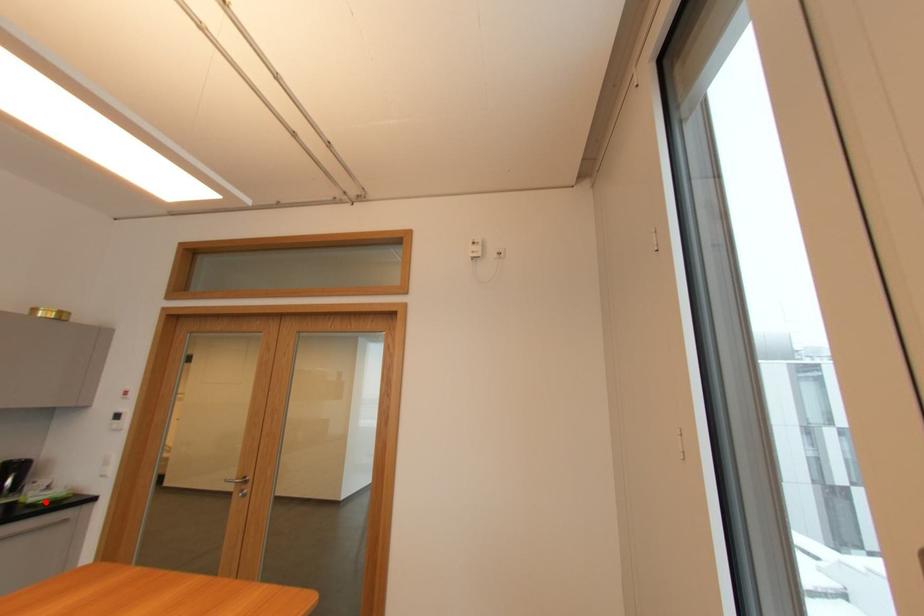
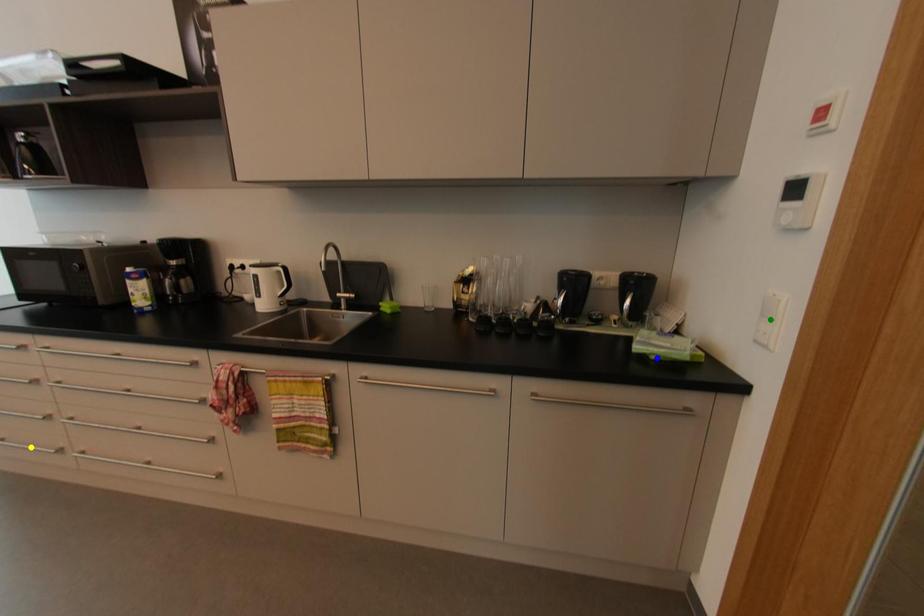
Question: I am providing you with two images of the same scene from different viewpoints. A red point is marked on the first image. You are given multiple points on the second image. Which point in image 2 is actually the same real-world point as the red point in image 1?

Choices:
 (A) green point
 (B) yellow point
 (C) blue point

Answer: (C)